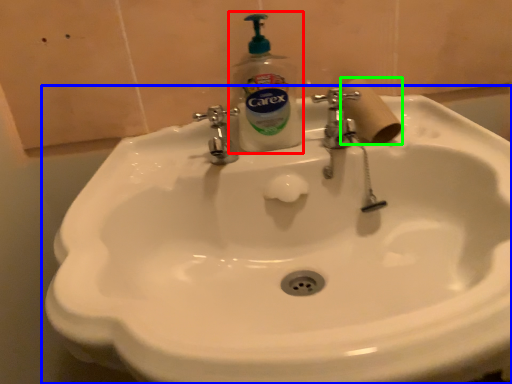
Question: Which is nearer to the soap dispenser (highlighted by a red box)? sink (highlighted by a blue box) or toilet paper (highlighted by a green box).

Choices:
 (A) sink
 (B) toilet paper

Answer: (B)